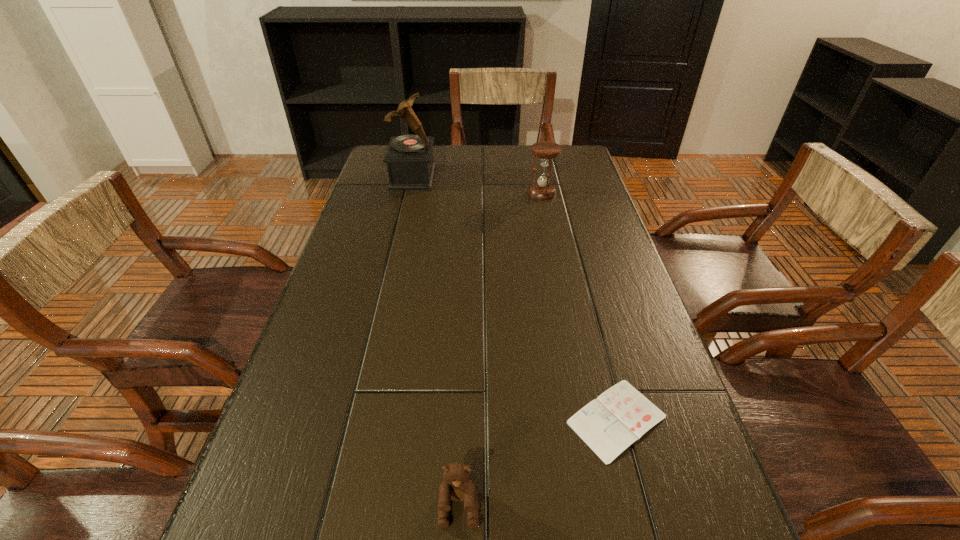
Image resolution: width=960 pixels, height=540 pixels. In order to click on free space that satisfies the following two spatial constraints: 1. on the front side of the third shortest object; 2. on the right side of the diary in this screenshot , I will do `click(589, 419)`.

Identify the location of free space that satisfies the following two spatial constraints: 1. at the horn opening of the phonograph_record; 2. on the back side of the second nearest object. This screenshot has width=960, height=540. (355, 419).

The height and width of the screenshot is (540, 960). I want to click on free spot that satisfies the following two spatial constraints: 1. at the horn opening of the phonograph_record; 2. on the right side of the third shortest object, so click(409, 192).

Locate an element on the screen. This screenshot has width=960, height=540. vacant space that satisfies the following two spatial constraints: 1. on the front side of the second nearest object; 2. on the right side of the second tallest object is located at coordinates (589, 419).

Find the location of a particular element. free point that satisfies the following two spatial constraints: 1. at the horn opening of the second nearest object; 2. on the left side of the leftmost object is located at coordinates (355, 419).

Where is `vacant space that satisfies the following two spatial constraints: 1. at the horn opening of the hourglass; 2. on the right side of the leftmost object`? vacant space that satisfies the following two spatial constraints: 1. at the horn opening of the hourglass; 2. on the right side of the leftmost object is located at coordinates point(409,192).

This screenshot has width=960, height=540. In order to click on vacant space that satisfies the following two spatial constraints: 1. on the front side of the shortest object; 2. on the left side of the third shortest object in this screenshot , I will do [x=589, y=419].

Find the location of `blank area in the image that satisfies the following two spatial constraints: 1. at the horn opening of the leftmost object; 2. on the left side of the third farthest object`. blank area in the image that satisfies the following two spatial constraints: 1. at the horn opening of the leftmost object; 2. on the left side of the third farthest object is located at coordinates (355, 419).